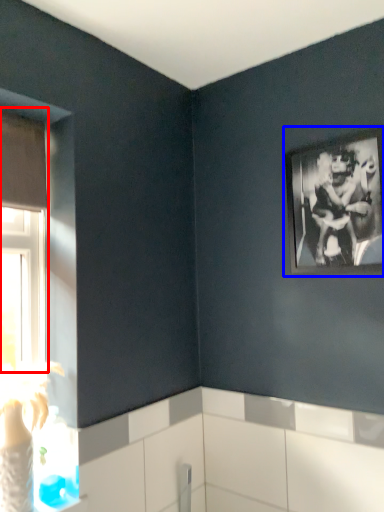
Question: Which point is further to the camera, window (highlighted by a red box) or picture frame (highlighted by a blue box)?

Choices:
 (A) window
 (B) picture frame

Answer: (B)